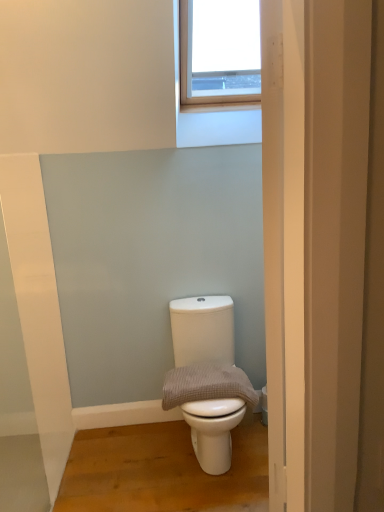
Question: Is white matte toilet at center bigger or smaller than waffle-textured towel at center?

Choices:
 (A) small
 (B) big

Answer: (B)

Question: Is point (248, 393) positioned closer to the camera than point (205, 388)?

Choices:
 (A) closer
 (B) farther

Answer: (B)

Question: From a real-world perspective, relative to waffle-textured towel at center, is white matte toilet at center vertically above or below?

Choices:
 (A) above
 (B) below

Answer: (B)

Question: From the image's perspective, is waffle-textured towel at center positioned above or below white matte toilet at center?

Choices:
 (A) below
 (B) above

Answer: (B)

Question: In terms of height, does waffle-textured towel at center look taller or shorter compared to white matte toilet at center?

Choices:
 (A) short
 (B) tall

Answer: (A)

Question: In terms of width, does waffle-textured towel at center look wider or thinner when compared to white matte toilet at center?

Choices:
 (A) wide
 (B) thin

Answer: (B)

Question: Is point (193, 376) closer or farther from the camera than point (183, 397)?

Choices:
 (A) farther
 (B) closer

Answer: (A)